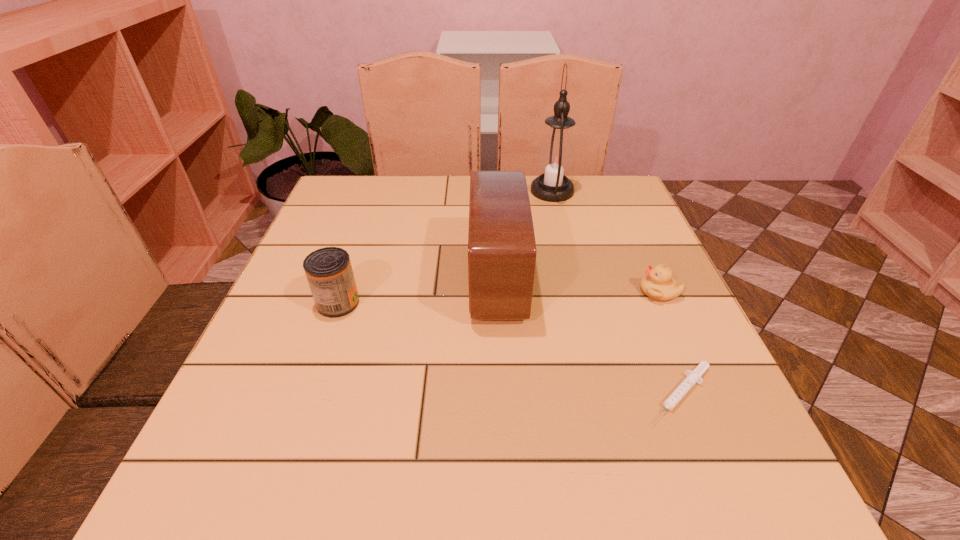
The image size is (960, 540). I want to click on oil lamp that is at the right edge, so click(x=556, y=158).

Find the location of a particular element. The width and height of the screenshot is (960, 540). duckling that is at the right edge is located at coordinates (658, 284).

I want to click on syringe positioned at the right edge, so (693, 377).

Find the location of `object that is at the far right corner`. object that is at the far right corner is located at coordinates (556, 158).

Locate an element on the screen. This screenshot has width=960, height=540. vacant space at the far edge is located at coordinates (405, 179).

This screenshot has height=540, width=960. In the image, there is a desktop. Identify the location of vacant space at the left edge. (366, 248).

Locate an element on the screen. Image resolution: width=960 pixels, height=540 pixels. vacant space at the right edge of the desktop is located at coordinates pos(659,301).

The width and height of the screenshot is (960, 540). I want to click on vacant space at the far left corner, so click(x=359, y=185).

At what (x,y) coordinates should I click in order to perform the action: click on vacant space at the near left corner. Please return your answer as a coordinate pair (x, y). The width and height of the screenshot is (960, 540). Looking at the image, I should click on (269, 464).

You are a GUI agent. You are given a task and a screenshot of the screen. Output one action in this format:
    pyautogui.click(x=<x>, y=<y>)
    Task: Click on the free space at the far right corner of the desktop
    Image resolution: width=960 pixels, height=540 pixels.
    Given the screenshot: What is the action you would take?
    pyautogui.click(x=625, y=213)